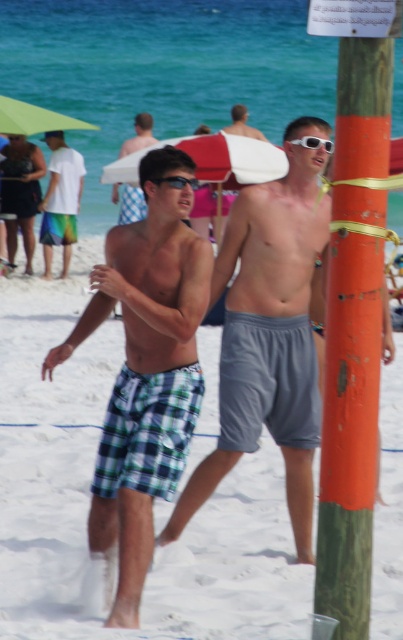
You are a lifeguard standing at the edge of the beach looking towards the volleyball net pole. You notice the white plastic goggles at center. Can you estimate the coordinates of the goggles relative to the pole?

The white plastic goggles at center are located at coordinates point (313, 141) relative to the volleyball net pole.

You are a photographer trying to capture a photo of the checkered fabric shorts at center and the green wood pole at right. Based on their positions, which object should you focus on first if you want to include both in your shot without moving the camera?

The green wood pole at right is positioned on the right side of checkered fabric shorts at center, so you should focus on the checkered fabric shorts at center first to ensure both are in frame without moving the camera.

You are a photographer trying to capture a photo of the checkered fabric shorts at center. However, the green wood pole at right is blocking your view. Can you move the pole to the side to get a clear shot?

The green wood pole at right is in front of the checkered fabric shorts at center, so moving the pole would allow you to see the checkered fabric shorts at center clearly.